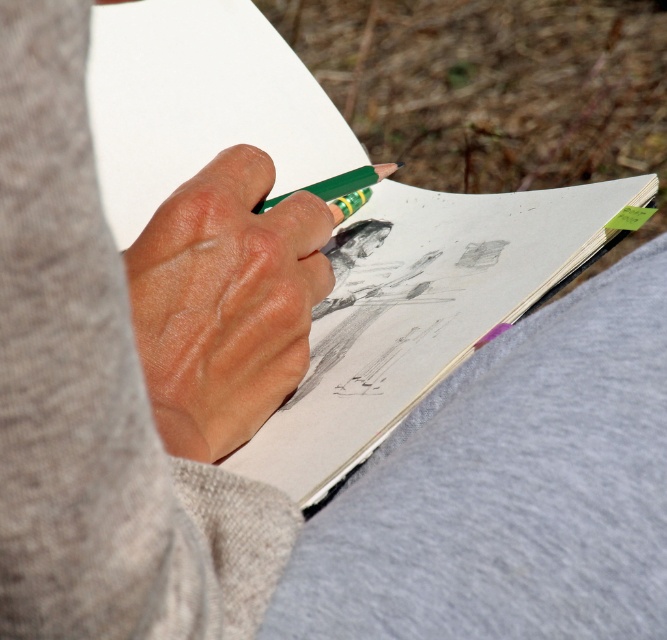
Looking at this image, which is more to the left, white paper at center or dry skin at center?

dry skin at center is more to the left.

Find the location of `white paper at center`. white paper at center is located at coordinates (420, 314).

Is point (67, 198) closer to viewer compared to point (392, 172)?

Yes, point (67, 198) is in front of point (392, 172).

The height and width of the screenshot is (640, 667). What are the coordinates of `matte gray sweater at upper left` in the screenshot? It's located at (95, 397).

Who is taller, dry skin at center or green matte pencil at center?

Standing taller between the two is dry skin at center.

Is point (183, 312) positioned after point (370, 168)?

No, (183, 312) is closer to viewer.

The width and height of the screenshot is (667, 640). Find the location of `dry skin at center`. dry skin at center is located at coordinates (225, 301).